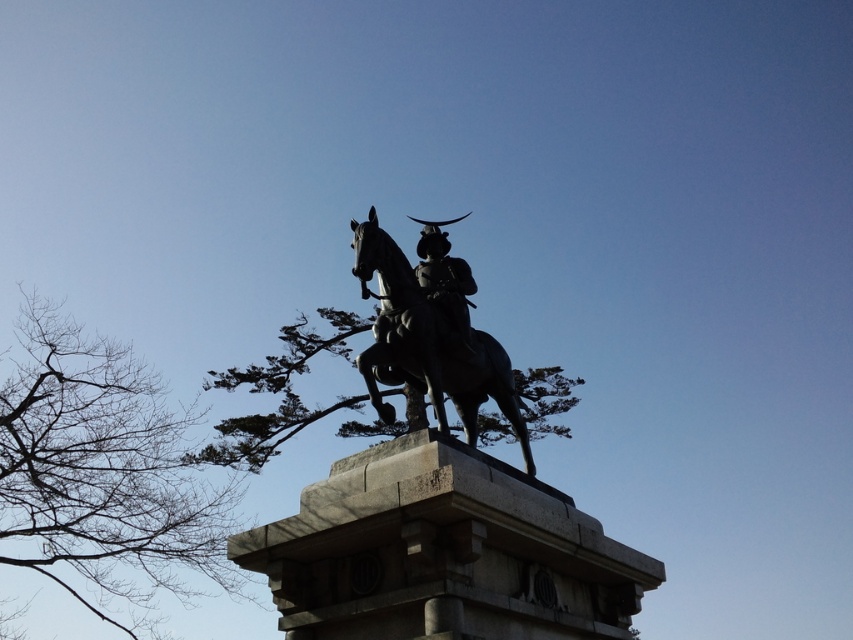
You are an art student analyzing the statue of the mounted figure. You notice the bronze horse at center and the shiny bronze helmet at center. Which object is shorter in height?

The bronze horse at center is shorter than the shiny bronze helmet at center.

You are standing in front of the statue and want to take a photo of the bare branches at left. Where should you look to capture them in your camera view?

The bare branches at left are located at point 0.738 on the horizontal axis and 0.122 on the vertical axis, so you should aim your camera towards that coordinate to capture them.

You are standing in front of the statue of the mounted figure and notice two elements in the image. You see the bare branches at left and the bronze horse at center. Which of these is located to the left of the other?

The bare branches at left is positioned on the left side of bronze horse at center.